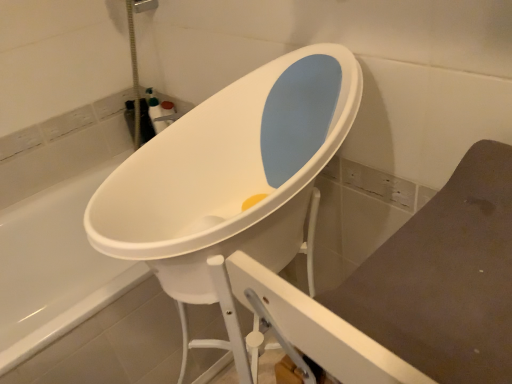
Locate an element on the screen. This screenshot has height=384, width=512. white plastic bathtub at center is located at coordinates (54, 267).

What is the approximate height of white plastic bathtub at center?

20.74 inches.

Measure the distance between point (19, 233) and camera.

They are 1.50 meters apart.

This screenshot has width=512, height=384. What do you see at coordinates (54, 267) in the screenshot?
I see `white plastic bathtub at center` at bounding box center [54, 267].

Where is `white plastic bathtub at center`? The width and height of the screenshot is (512, 384). white plastic bathtub at center is located at coordinates [x=54, y=267].